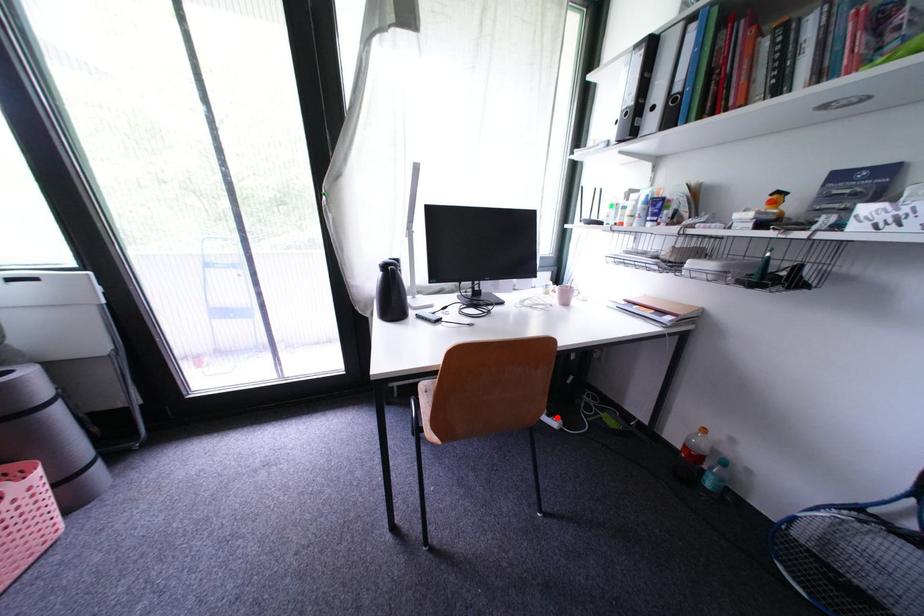
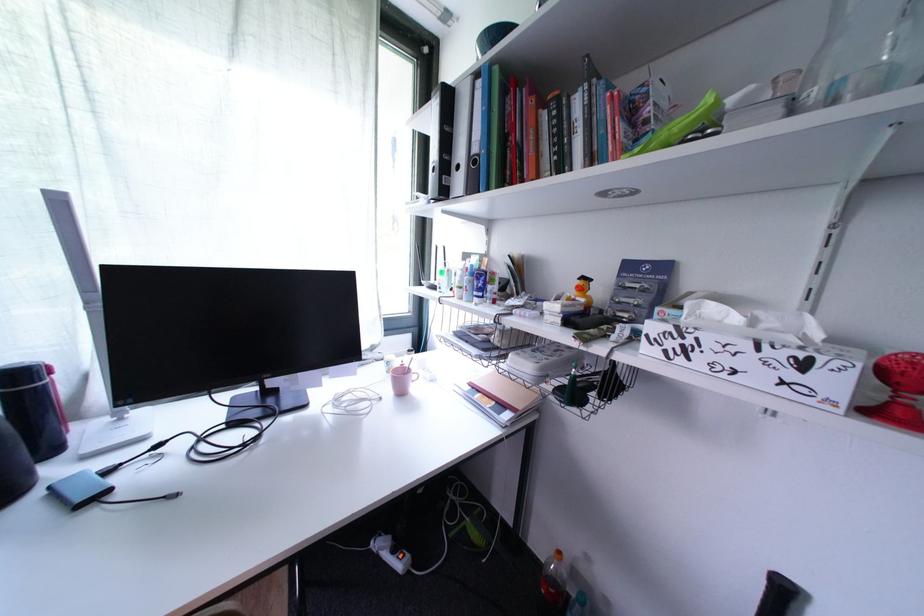
Where in the second image is the point corresponding to the highlighted location from the first image?

(402, 553)